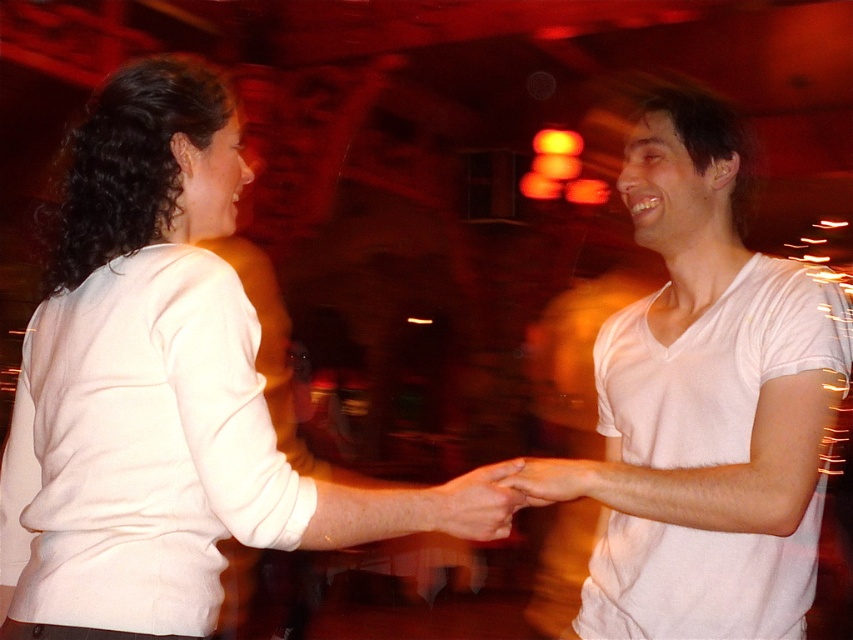
Question: Does white matte shirt at center appear on the left side of smooth skin hand at center?

Choices:
 (A) yes
 (B) no

Answer: (A)

Question: Can you confirm if white matte shirt at center is smaller than white cotton shirt at right?

Choices:
 (A) no
 (B) yes

Answer: (A)

Question: Is white cotton shirt at right smaller than smooth skin hand at center?

Choices:
 (A) no
 (B) yes

Answer: (A)

Question: Which of the following is the farthest from the observer?

Choices:
 (A) smooth skin hand at center
 (B) matte white hand at center

Answer: (A)

Question: Among these points, which one is farthest from the camera?

Choices:
 (A) (497, 515)
 (B) (621, 467)

Answer: (B)

Question: Which is farther from the white cotton shirt at right?

Choices:
 (A) white matte shirt at center
 (B) smooth skin hand at center
 (C) matte white hand at center

Answer: (A)